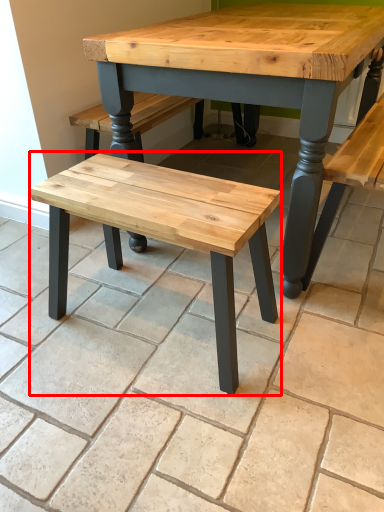
Question: From the image's perspective, where is stool (annotated by the red box) located relative to tile?

Choices:
 (A) above
 (B) below

Answer: (B)